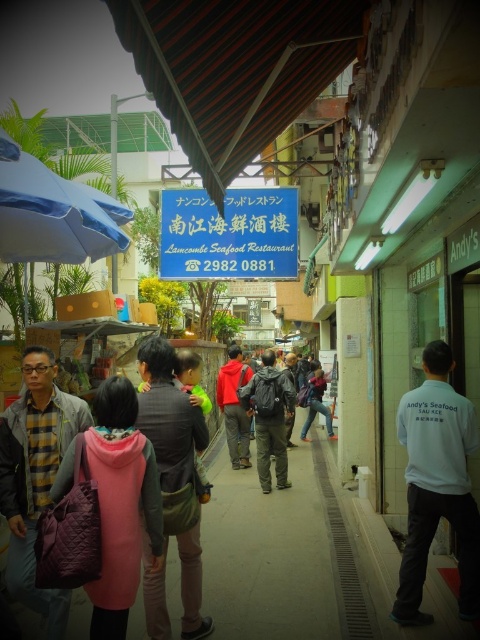
You are a delivery person who needs to carry both the blue fabric umbrella at left and the dark gray backpack at center. Which item takes up more space in your delivery van?

The dark gray backpack at center takes up more space than the blue fabric umbrella at left because the blue fabric umbrella at left occupies less space than dark gray backpack at center.

You are a street vendor who needs to choose between placing your new stand under the blue fabric umbrella at left or the dark gray backpack at center. Which option provides more coverage for your items?

The blue fabric umbrella at left has a larger width than the dark gray backpack at center, so it provides more coverage for your items.